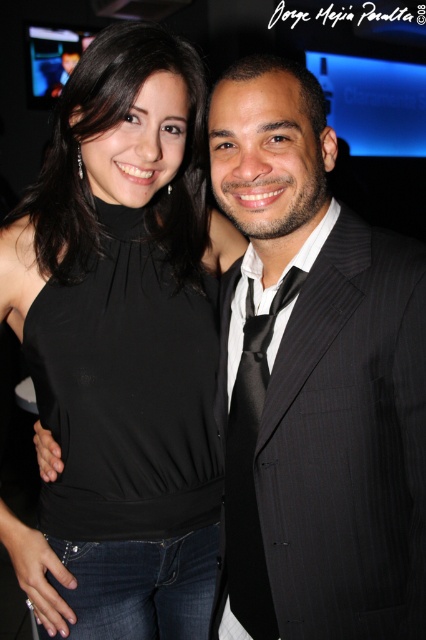
Question: Is black matte top at center closer to the viewer compared to black pinstripe suit at center?

Choices:
 (A) yes
 (B) no

Answer: (B)

Question: Which object is farther from the camera taking this photo?

Choices:
 (A) black satin halter top at center
 (B) black satin tie at center
 (C) black pinstripe suit at center
 (D) black matte top at center

Answer: (A)

Question: Which of these objects is positioned closest to the black satin tie at center?

Choices:
 (A) black matte top at center
 (B) black satin halter top at center
 (C) black pinstripe suit at center

Answer: (C)

Question: Which point appears closest to the camera in this image?

Choices:
 (A) tap(155, 320)
 (B) tap(253, 96)
 (C) tap(94, 154)

Answer: (B)

Question: Can you confirm if black matte top at center is positioned to the right of black satin halter top at center?

Choices:
 (A) yes
 (B) no

Answer: (B)

Question: Where is black matte top at center located in relation to black satin halter top at center in the image?

Choices:
 (A) above
 (B) below

Answer: (A)